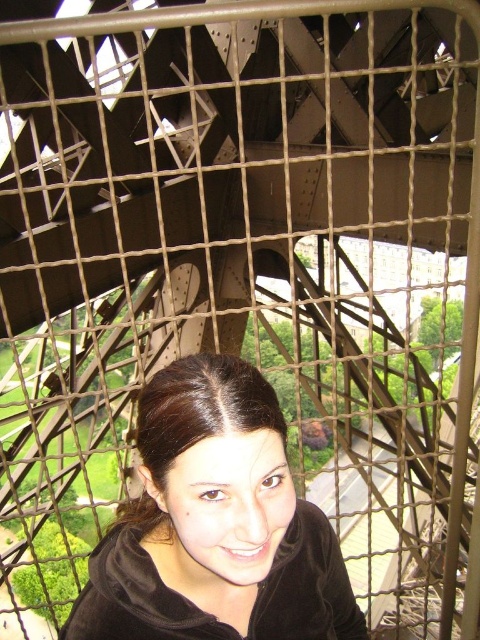
Question: Can you confirm if matte black hoodie at center is positioned below dark brown hair at center?

Choices:
 (A) yes
 (B) no

Answer: (A)

Question: Where is matte black hoodie at center located in relation to dark brown hair at center in the image?

Choices:
 (A) above
 (B) below

Answer: (B)

Question: Which point is closer to the camera?

Choices:
 (A) matte black hoodie at center
 (B) dark brown hair at center

Answer: (A)

Question: Is matte black hoodie at center to the left of dark brown hair at center from the viewer's perspective?

Choices:
 (A) no
 (B) yes

Answer: (A)